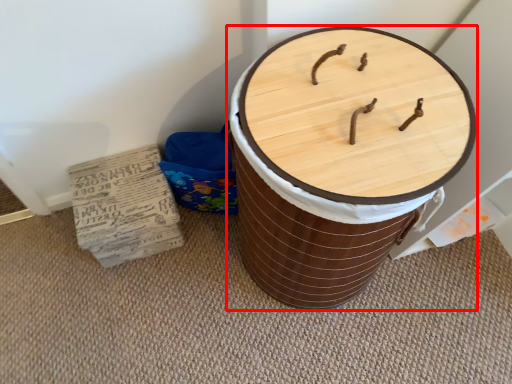
Question: From the image's perspective, what is the correct spatial positioning of furniture (annotated by the red box) in reference to cardboard?

Choices:
 (A) below
 (B) above

Answer: (B)